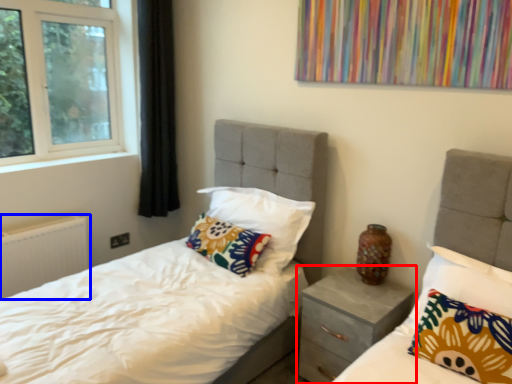
Question: Which point is further to the camera, nightstand (highlighted by a red box) or radiator (highlighted by a blue box)?

Choices:
 (A) nightstand
 (B) radiator

Answer: (B)